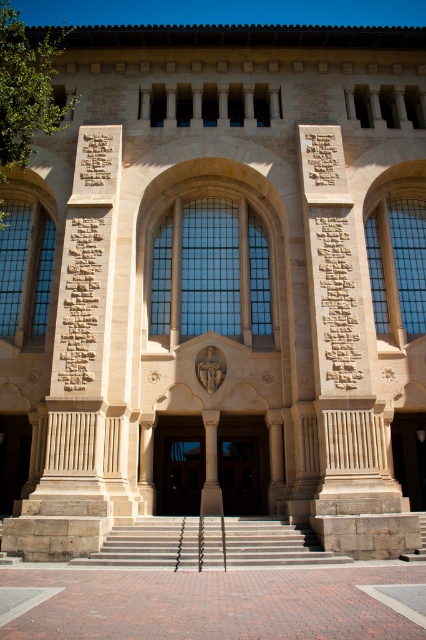
Can you confirm if black stone inscription at center is smaller than carved stone inscription at center?

Indeed, black stone inscription at center has a smaller size compared to carved stone inscription at center.

Does black stone inscription at center have a greater width compared to carved stone inscription at center?

Indeed, black stone inscription at center has a greater width compared to carved stone inscription at center.

Which is in front, point (321, 161) or point (109, 173)?

Positioned in front is point (109, 173).

Where is `black stone inscription at center`? The image size is (426, 640). black stone inscription at center is located at coordinates (322, 157).

Describe the element at coordinates (210, 544) in the screenshot. I see `light gray concrete stairs at center` at that location.

The height and width of the screenshot is (640, 426). Describe the element at coordinates (210, 544) in the screenshot. I see `light gray concrete stairs at center` at that location.

At what (x,y) coordinates should I click in order to perform the action: click on light gray concrete stairs at center. Please return your answer as a coordinate pair (x, y). Looking at the image, I should click on (210, 544).

Is light gray concrete stairs at center smaller than carved stone inscription at center?

Incorrect, light gray concrete stairs at center is not smaller in size than carved stone inscription at center.

Who is positioned more to the right, light gray concrete stairs at center or carved stone inscription at center?

From the viewer's perspective, light gray concrete stairs at center appears more on the right side.

Does point (253, 544) come behind point (86, 134)?

No, it is in front of (86, 134).

Locate an element on the screen. This screenshot has width=426, height=640. light gray concrete stairs at center is located at coordinates (210, 544).